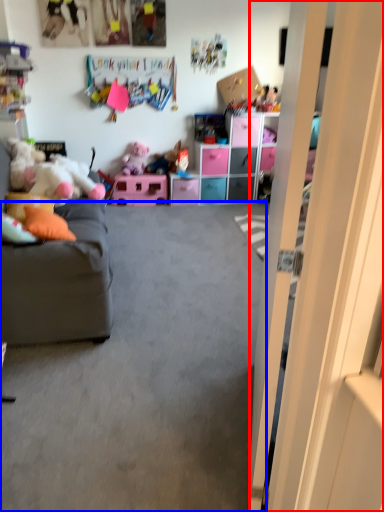
Question: Among these objects, which one is nearest to the camera, door (highlighted by a red box) or plain (highlighted by a blue box)?

Choices:
 (A) door
 (B) plain

Answer: (A)